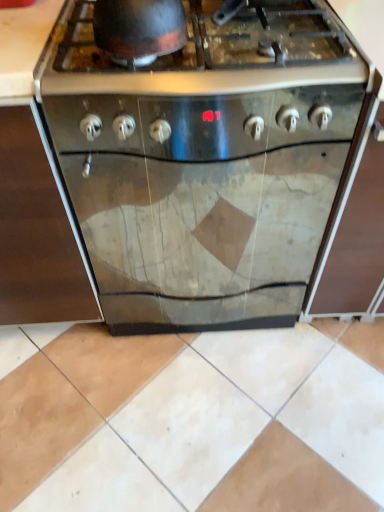
The height and width of the screenshot is (512, 384). Describe the element at coordinates (192, 418) in the screenshot. I see `beige ceramic tile at lower center` at that location.

The image size is (384, 512). What do you see at coordinates (36, 233) in the screenshot?
I see `stainless steel oven at left` at bounding box center [36, 233].

Find the location of a particular element. stainless steel oven at center is located at coordinates click(207, 157).

Describe the element at coordinates (139, 29) in the screenshot. The image size is (384, 512). I see `shiny black wok at upper center` at that location.

This screenshot has height=512, width=384. What are the coordinates of `beige ceramic tile at lower center` in the screenshot? It's located at (192, 418).

Is stainless steel oven at left facing away from stainless steel oven at center?

No.

Considering the relative positions of stainless steel oven at left and stainless steel oven at center in the image provided, is stainless steel oven at left to the left of stainless steel oven at center from the viewer's perspective?

Yes.

How different are the orientations of stainless steel oven at left and stainless steel oven at center in degrees?

The angular difference between stainless steel oven at left and stainless steel oven at center is 4.86e-05 degrees.

Looking at their sizes, would you say stainless steel oven at left is wider or thinner than stainless steel oven at center?

In the image, stainless steel oven at left appears to be wider than stainless steel oven at center.

Does shiny black wok at upper center turn towards stainless steel gas stove at center?

No, shiny black wok at upper center does not turn towards stainless steel gas stove at center.

In the scene shown: Is shiny black wok at upper center beside stainless steel gas stove at center?

shiny black wok at upper center and stainless steel gas stove at center are not in contact.

Locate an element on the screen. wok positioned vertically above the stainless steel gas stove at center (from a real-world perspective) is located at coordinates (139, 29).

Does shiny black wok at upper center touch stainless steel oven at center?

No, shiny black wok at upper center is not beside stainless steel oven at center.

Is shiny black wok at upper center shorter than stainless steel oven at center?

Yes, shiny black wok at upper center is shorter than stainless steel oven at center.

Would you say shiny black wok at upper center is inside or outside stainless steel oven at center?

shiny black wok at upper center cannot be found inside stainless steel oven at center.

Does shiny black wok at upper center have a lesser width compared to stainless steel oven at center?

Yes, shiny black wok at upper center is thinner than stainless steel oven at center.

Based on the photo, can you confirm if stainless steel oven at center is bigger than beige ceramic tile at lower center?

Yes, stainless steel oven at center is bigger than beige ceramic tile at lower center.

Is point (230, 247) positioned after point (146, 406)?

Yes.

In the image, is stainless steel oven at center on the left side or the right side of beige ceramic tile at lower center?

In the image, stainless steel oven at center appears on the right side of beige ceramic tile at lower center.

Which of these two, stainless steel oven at center or beige ceramic tile at lower center, is thinner?

beige ceramic tile at lower center.

Who is taller, beige ceramic tile at lower center or stainless steel oven at left?

stainless steel oven at left is taller.

Between beige ceramic tile at lower center and stainless steel oven at left, which one has larger size?

Bigger between the two is stainless steel oven at left.

Considering the sizes of objects beige ceramic tile at lower center and stainless steel oven at left in the image provided, who is wider, beige ceramic tile at lower center or stainless steel oven at left?

stainless steel oven at left.

The image size is (384, 512). In the image, there is a stainless steel oven at left. Find the location of `ceramic tile below it (from the image's perspective)`. ceramic tile below it (from the image's perspective) is located at coordinates (192, 418).

There is a stainless steel oven at center. Identify the location of wok above it (from a real-world perspective). The width and height of the screenshot is (384, 512). (139, 29).

Is stainless steel oven at center looking in the opposite direction of shiny black wok at upper center?

No.

Does stainless steel oven at center appear on the right side of shiny black wok at upper center?

Yes.

Is stainless steel oven at center placed right next to shiny black wok at upper center?

No.

Is stainless steel gas stove at center not within shiny black wok at upper center?

Indeed, stainless steel gas stove at center is completely outside shiny black wok at upper center.

Considering the sizes of stainless steel gas stove at center and shiny black wok at upper center in the image, is stainless steel gas stove at center wider or thinner than shiny black wok at upper center?

Considering their sizes, stainless steel gas stove at center looks broader than shiny black wok at upper center.

Consider the image. Is the position of stainless steel gas stove at center more distant than that of shiny black wok at upper center?

Yes, stainless steel gas stove at center is further from the camera.

Locate an element on the screen. gas stove that appears below the shiny black wok at upper center (from a real-world perspective) is located at coordinates (208, 53).

Find the location of a particular element. kitchen appliance lying below the stainless steel oven at left (from the image's perspective) is located at coordinates (207, 157).

Where is `gas stove located behind the shiny black wok at upper center`? This screenshot has height=512, width=384. gas stove located behind the shiny black wok at upper center is located at coordinates (208, 53).

Based on their spatial positions, is stainless steel oven at center or shiny black wok at upper center closer to beige ceramic tile at lower center?

The object closer to beige ceramic tile at lower center is stainless steel oven at center.

When comparing their distances from shiny black wok at upper center, does stainless steel oven at center or stainless steel gas stove at center seem further?

stainless steel oven at center is further to shiny black wok at upper center.

From the image, which object appears to be nearer to beige ceramic tile at lower center, shiny black wok at upper center or stainless steel oven at center?

Among the two, stainless steel oven at center is located nearer to beige ceramic tile at lower center.

Considering their positions, is stainless steel gas stove at center positioned further to shiny black wok at upper center than beige ceramic tile at lower center?

Among the two, beige ceramic tile at lower center is located further to shiny black wok at upper center.

From the picture: Estimate the real-world distances between objects in this image. Which object is further from stainless steel gas stove at center, stainless steel oven at center or shiny black wok at upper center?

stainless steel oven at center.

Based on the photo, which object lies nearer to the anchor point stainless steel oven at left, shiny black wok at upper center or stainless steel gas stove at center?

stainless steel gas stove at center is positioned closer to the anchor stainless steel oven at left.

When comparing their distances from stainless steel gas stove at center, does stainless steel oven at center or beige ceramic tile at lower center seem further?

beige ceramic tile at lower center.

When comparing their distances from shiny black wok at upper center, does beige ceramic tile at lower center or stainless steel oven at center seem further?

beige ceramic tile at lower center is further to shiny black wok at upper center.

This screenshot has width=384, height=512. I want to click on cabinetry between stainless steel gas stove at center and beige ceramic tile at lower center in the vertical direction, so click(x=36, y=233).

Find the location of a particular element. gas stove between stainless steel oven at left and stainless steel oven at center in the horizontal direction is located at coordinates (208, 53).

This screenshot has width=384, height=512. What are the coordinates of `wok between stainless steel oven at left and stainless steel gas stove at center` in the screenshot? It's located at (139, 29).

The height and width of the screenshot is (512, 384). Identify the location of cabinetry between shiny black wok at upper center and beige ceramic tile at lower center in the vertical direction. (36, 233).